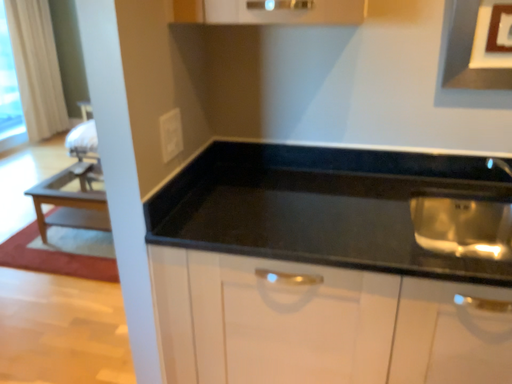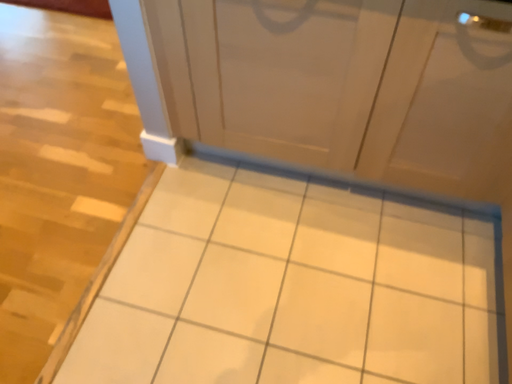
Question: How did the camera likely rotate when shooting the video?

Choices:
 (A) rotated upward
 (B) rotated downward

Answer: (B)